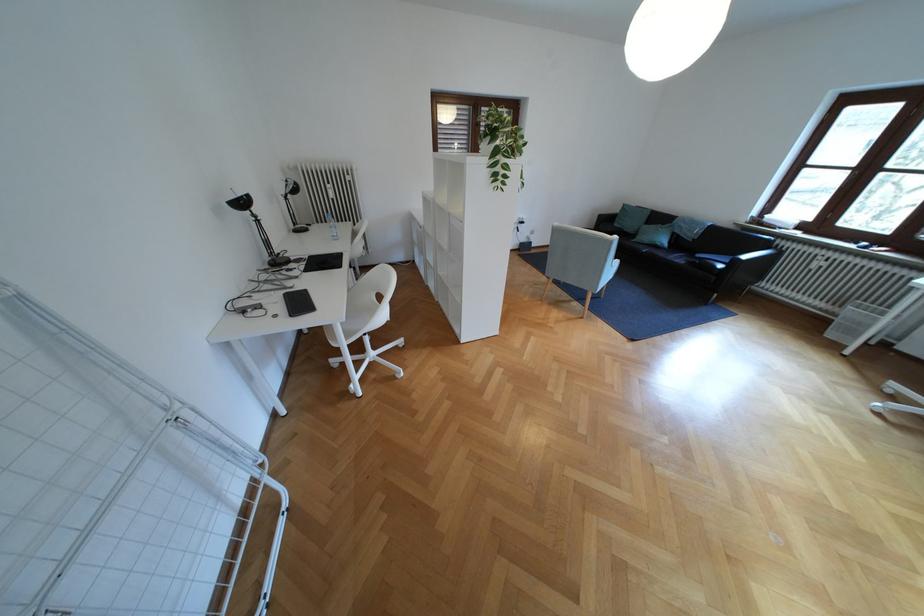
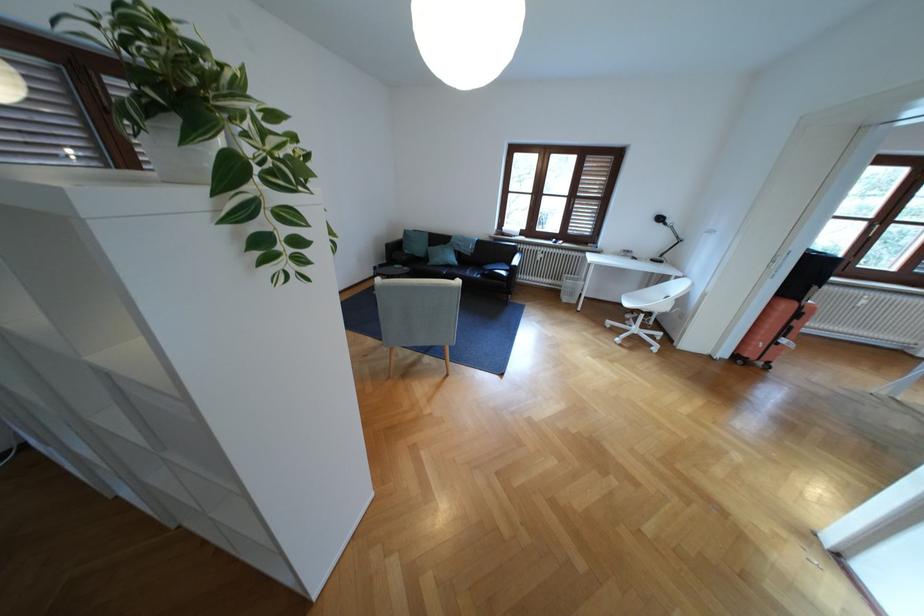
The point at (626, 225) is marked in the first image. Where is the corresponding point in the second image?

(417, 252)